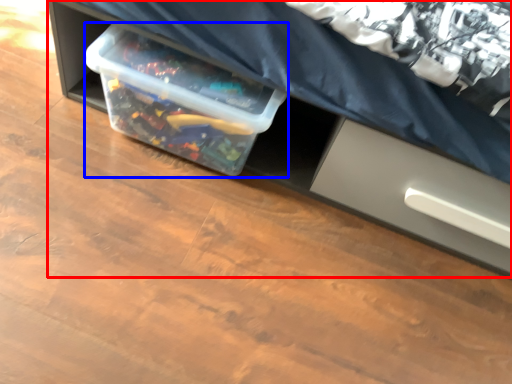
Question: Which object appears closest to the camera in this image, furniture (highlighted by a red box) or box (highlighted by a blue box)?

Choices:
 (A) furniture
 (B) box

Answer: (A)